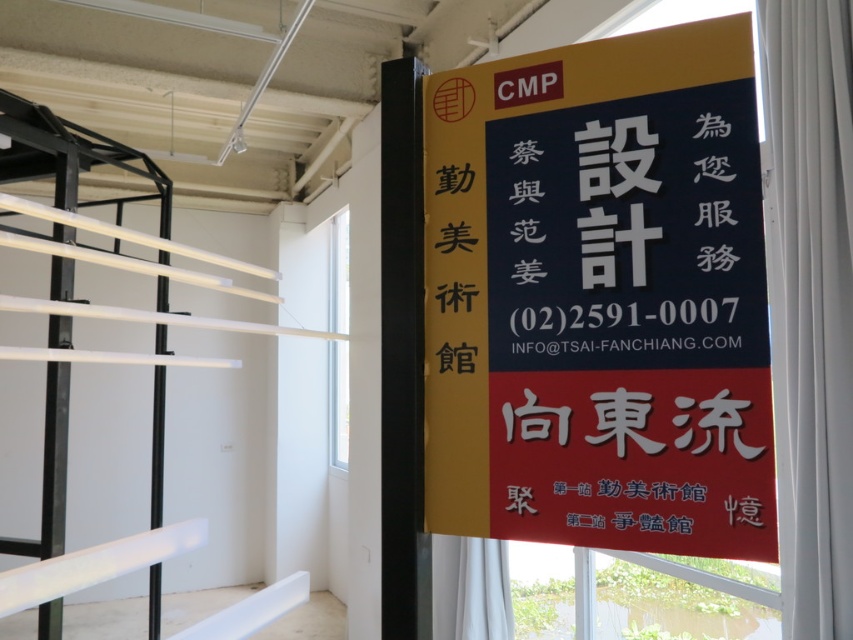
You are standing in the gallery and want to read the information on the matte black signboard at center and the transparent glass window at upper center. Which object is shorter?

The matte black signboard at center is shorter than the transparent glass window at upper center.

Looking at this image, you are standing in the modern interior space described. There is a point marked at coordinates (x=599, y=298). Which object from the scene does this point belong to?

The point at coordinates (x=599, y=298) is on the matte black signboard at center.